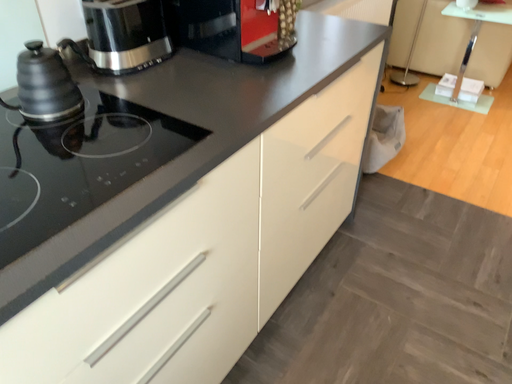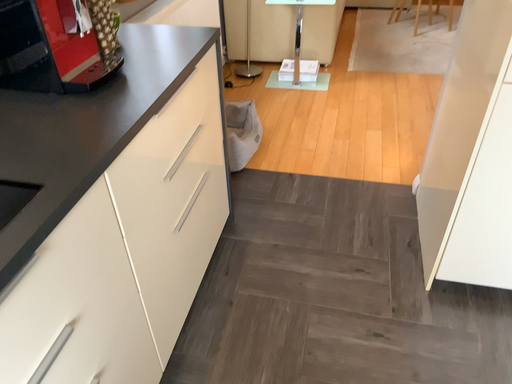
Question: How did the camera likely rotate when shooting the video?

Choices:
 (A) rotated right
 (B) rotated left

Answer: (A)